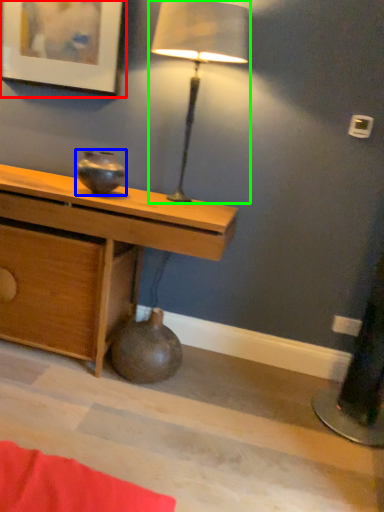
Question: Which object is the farthest from picture frame (highlighted by a red box)? Choose among these: vase (highlighted by a blue box) or lamp (highlighted by a green box).

Choices:
 (A) vase
 (B) lamp

Answer: (A)